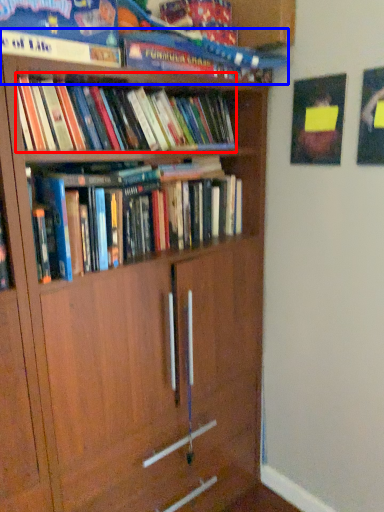
Question: Which object appears closest to the camera in this image, book (highlighted by a red box) or book (highlighted by a blue box)?

Choices:
 (A) book
 (B) book

Answer: (B)